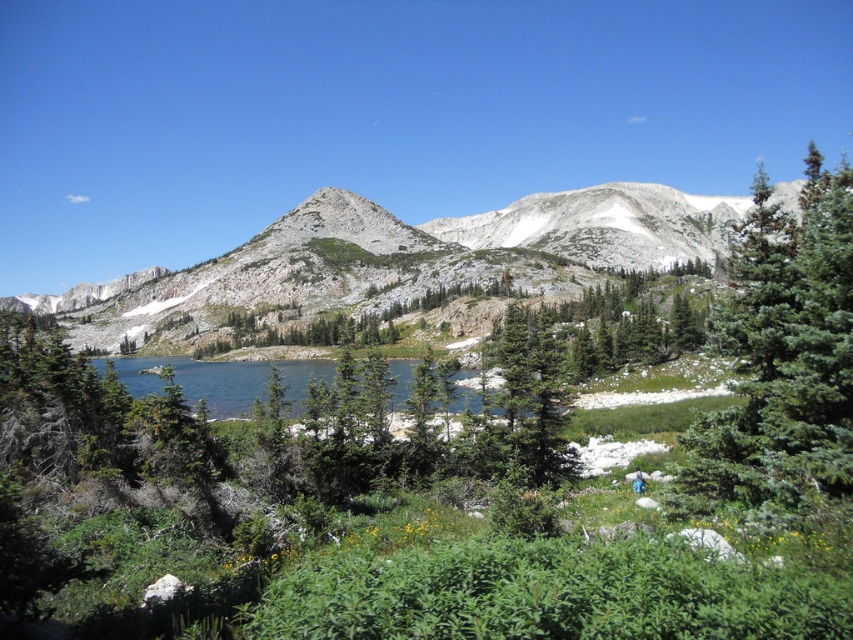
Does gray rocky mountain at center appear on the right side of blue glassy water at center?

In fact, gray rocky mountain at center is to the left of blue glassy water at center.

Who is higher up, gray rocky mountain at center or blue glassy water at center?

gray rocky mountain at center is above.

Which is behind, point (85, 339) or point (131, 372)?

Point (85, 339)

You are a GUI agent. You are given a task and a screenshot of the screen. Output one action in this format:
    pyautogui.click(x=<x>, y=<y>)
    Task: Click on the gray rocky mountain at center
    The width and height of the screenshot is (853, 640).
    Given the screenshot: What is the action you would take?
    pyautogui.click(x=405, y=257)

Between green fir tree at right and blue glassy water at center, which one is positioned lower?

Positioned lower is blue glassy water at center.

Who is taller, green fir tree at right or blue glassy water at center?

Standing taller between the two is green fir tree at right.

Between point (846, 476) and point (318, 378), which one is positioned in front?

Point (846, 476)

The width and height of the screenshot is (853, 640). Find the location of `green fir tree at right`. green fir tree at right is located at coordinates (782, 360).

Can you confirm if gray rocky mountain at center is positioned to the right of green fir tree at right?

No, gray rocky mountain at center is not to the right of green fir tree at right.

Who is positioned more to the right, gray rocky mountain at center or green fir tree at right?

green fir tree at right

Does point (4, 307) come closer to viewer compared to point (813, 195)?

No, it is behind (813, 195).

Where is `gray rocky mountain at center`? Image resolution: width=853 pixels, height=640 pixels. gray rocky mountain at center is located at coordinates (405, 257).